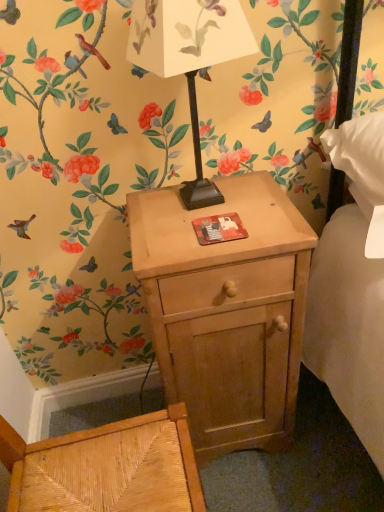
Question: Should I look upward or downward to see light wood nightstand at center?

Choices:
 (A) down
 (B) up

Answer: (A)

Question: From the image's perspective, would you say light wood nightstand at center is positioned over matte black table lamp at center?

Choices:
 (A) yes
 (B) no

Answer: (B)

Question: Is light wood nightstand at center oriented towards matte black table lamp at center?

Choices:
 (A) no
 (B) yes

Answer: (A)

Question: Considering the relative positions of light wood nightstand at center and matte black table lamp at center in the image provided, is light wood nightstand at center behind matte black table lamp at center?

Choices:
 (A) yes
 (B) no

Answer: (A)

Question: From a real-world perspective, is light wood nightstand at center physically below matte black table lamp at center?

Choices:
 (A) yes
 (B) no

Answer: (A)

Question: From the image's perspective, is light wood nightstand at center under matte black table lamp at center?

Choices:
 (A) no
 (B) yes

Answer: (B)

Question: Is light wood nightstand at center touching matte black table lamp at center?

Choices:
 (A) yes
 (B) no

Answer: (B)

Question: Does matte black table lamp at center appear on the left side of light wood nightstand at center?

Choices:
 (A) yes
 (B) no

Answer: (A)

Question: Is matte black table lamp at center positioned beyond the bounds of light wood nightstand at center?

Choices:
 (A) no
 (B) yes

Answer: (B)

Question: Considering the relative sizes of matte black table lamp at center and light wood nightstand at center in the image provided, is matte black table lamp at center thinner than light wood nightstand at center?

Choices:
 (A) yes
 (B) no

Answer: (A)

Question: Can you confirm if matte black table lamp at center is wider than light wood nightstand at center?

Choices:
 (A) yes
 (B) no

Answer: (B)

Question: Is matte black table lamp at center positioned before light wood nightstand at center?

Choices:
 (A) no
 (B) yes

Answer: (B)

Question: From a real-world perspective, is matte black table lamp at center located higher than light wood nightstand at center?

Choices:
 (A) no
 (B) yes

Answer: (B)

Question: Considering the positions of light wood nightstand at center and matte black table lamp at center in the image, is light wood nightstand at center wider or thinner than matte black table lamp at center?

Choices:
 (A) thin
 (B) wide

Answer: (B)